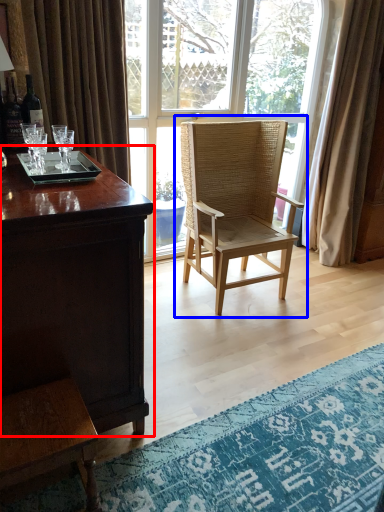
Question: Which of the following is the closest to the observer, desk (highlighted by a red box) or chair (highlighted by a blue box)?

Choices:
 (A) desk
 (B) chair

Answer: (A)